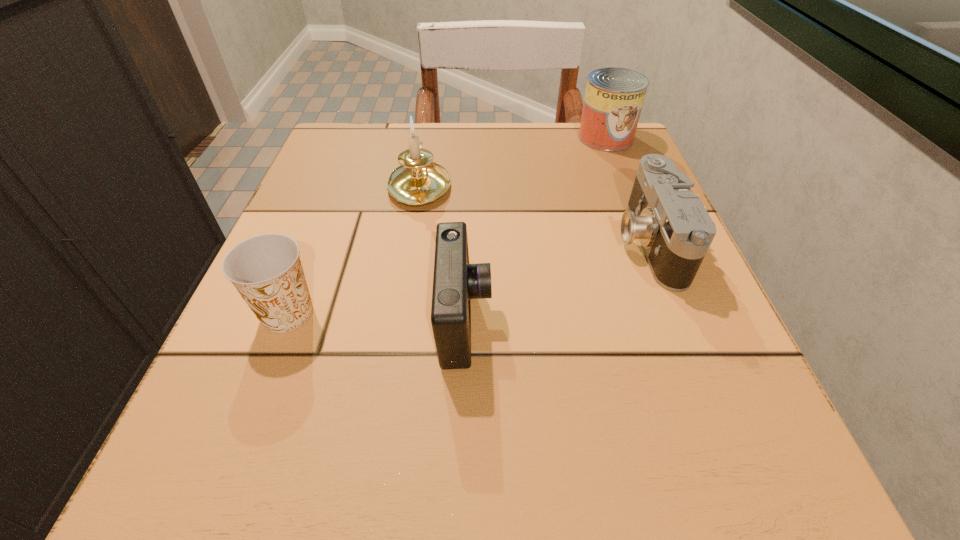
Find the location of a particular element. This screenshot has height=540, width=960. vacant space that's between the candle holder and the farthest object is located at coordinates (513, 161).

Identify the location of free point between the can and the candle holder. (513, 161).

Point out which object is positioned as the nearest to the right camera. Please provide its 2D coordinates. Your answer should be formatted as a tuple, i.e. [(x, y)], where the tuple contains the x and y coordinates of a point satisfying the conditions above.

[(614, 97)]

This screenshot has height=540, width=960. In order to click on the closest object to the Dixie cup in this screenshot , I will do `click(455, 282)`.

Where is `vacant region that satisfies the following two spatial constraints: 1. on the lens of the right camera; 2. on the front side of the leftmost object`? Image resolution: width=960 pixels, height=540 pixels. vacant region that satisfies the following two spatial constraints: 1. on the lens of the right camera; 2. on the front side of the leftmost object is located at coordinates 678,314.